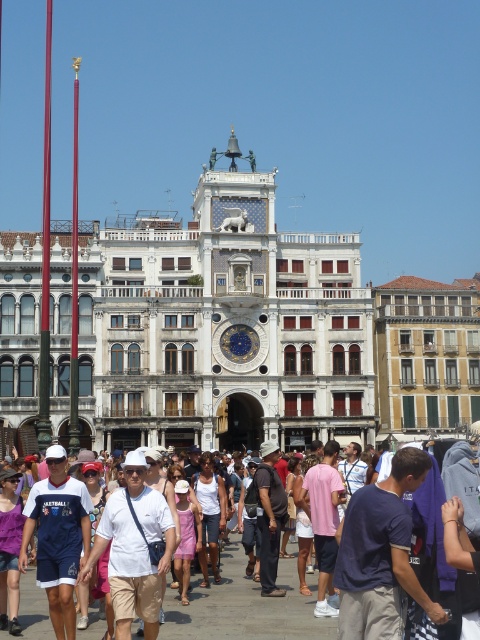
You are a tourist visiting Venice and you see two shirts hanging on a clothesline in the square. The shirts are a white cotton shirt at center and a pink cotton shirt at center. Which shirt would appear bigger to someone standing directly in front of them?

The white cotton shirt at center appears larger in size than the pink cotton shirt at center, so it would look bigger to someone standing directly in front of them.

You are a tourist standing in the public square in Venice, Italy, near the clock tower with the winged lion statue. You notice two shirts hanging on a clothesline between two poles at the center of the square. The shirts are labeled as the white cotton shirt at center and the pink cotton shirt at center. Which shirt is taller?

The white cotton shirt at center is taller than the pink cotton shirt at center.

You are a tourist in Venice and you see two shirts in the crowd. One is the white cotton shirt at center and the other is the matte white shirt at lower left. Which shirt is more to the right?

The white cotton shirt at center is more to the right side of the matte white shirt at lower left.